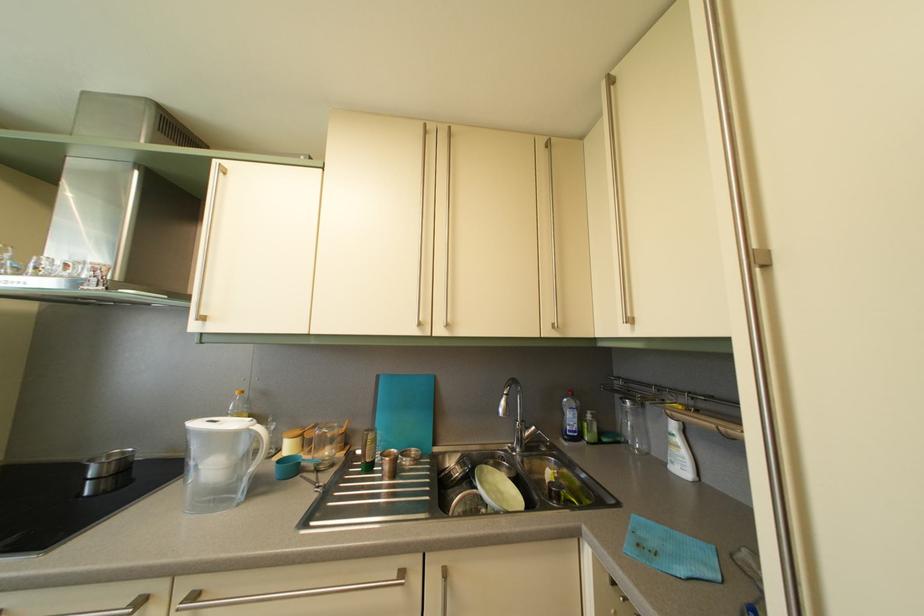
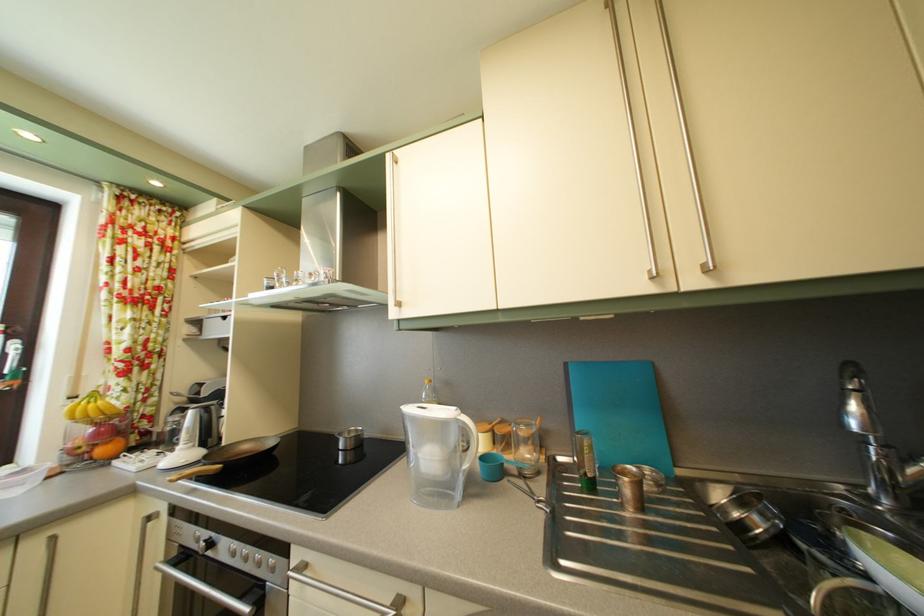
Question: The first image is from the beginning of the video and the second image is from the end. How did the camera likely rotate when shooting the video?

Choices:
 (A) Left
 (B) Right
 (C) Up
 (D) Down

Answer: (A)